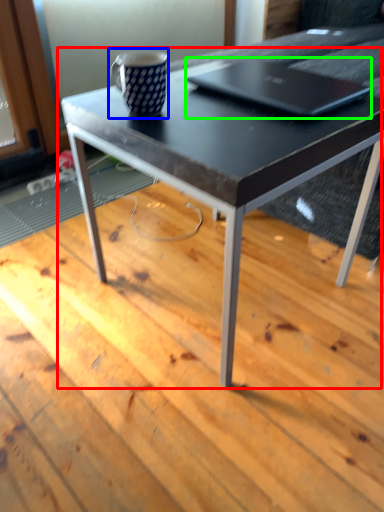
Question: Estimate the real-world distances between objects in this image. Which object is closer to coffee table (highlighted by a red box), coffee cup (highlighted by a blue box) or laptop (highlighted by a green box)?

Choices:
 (A) coffee cup
 (B) laptop

Answer: (B)